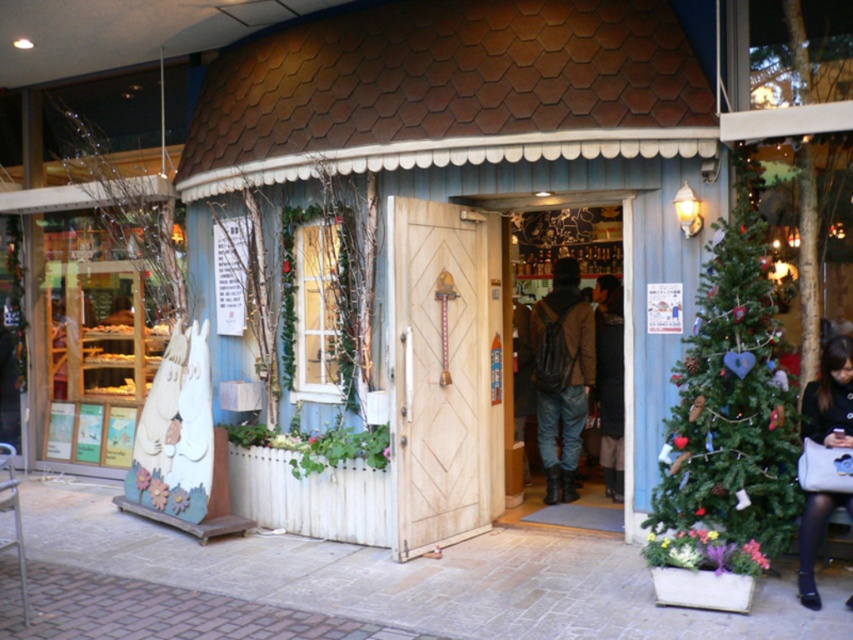
Question: Which of these objects is positioned closest to the brown leather jacket at center?

Choices:
 (A) black leather purse at lower right
 (B) wooden door at center

Answer: (B)

Question: Considering the relative positions of wooden door at center and black leather purse at lower right in the image provided, where is wooden door at center located with respect to black leather purse at lower right?

Choices:
 (A) left
 (B) right

Answer: (A)

Question: Does green matte christmas tree at right have a larger size compared to black leather purse at lower right?

Choices:
 (A) no
 (B) yes

Answer: (B)

Question: Which of the following is the farthest from the observer?

Choices:
 (A) (813, 528)
 (B) (286, 385)

Answer: (B)

Question: Is green matte christmas tree at right to the right of brown leather jacket at center from the viewer's perspective?

Choices:
 (A) no
 (B) yes

Answer: (B)

Question: Which of the following is the closest to the observer?

Choices:
 (A) black leather purse at lower right
 (B) green matte christmas tree at right
 (C) wooden door at center

Answer: (B)